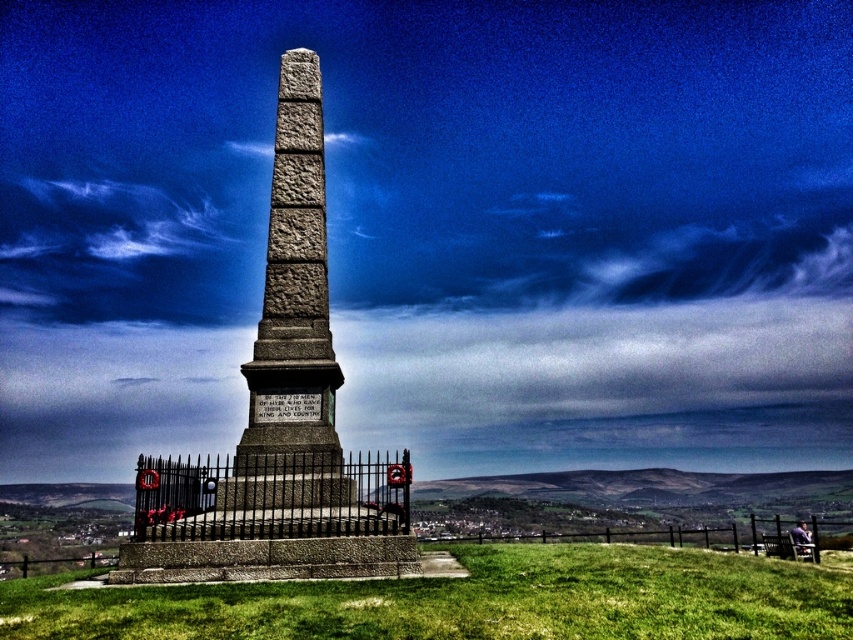
You are standing on the grassy hilltop and looking at the granite obelisk at center and the green grass at center. Which object is higher in elevation?

The granite obelisk at center is above the green grass at center, so it is higher in elevation.